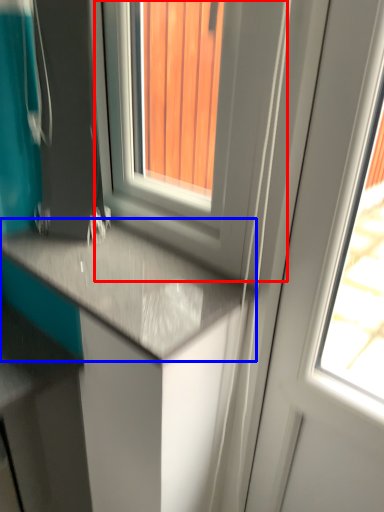
Question: Which object appears farthest to the camera in this image, window (highlighted by a red box) or countertop (highlighted by a blue box)?

Choices:
 (A) window
 (B) countertop

Answer: (B)